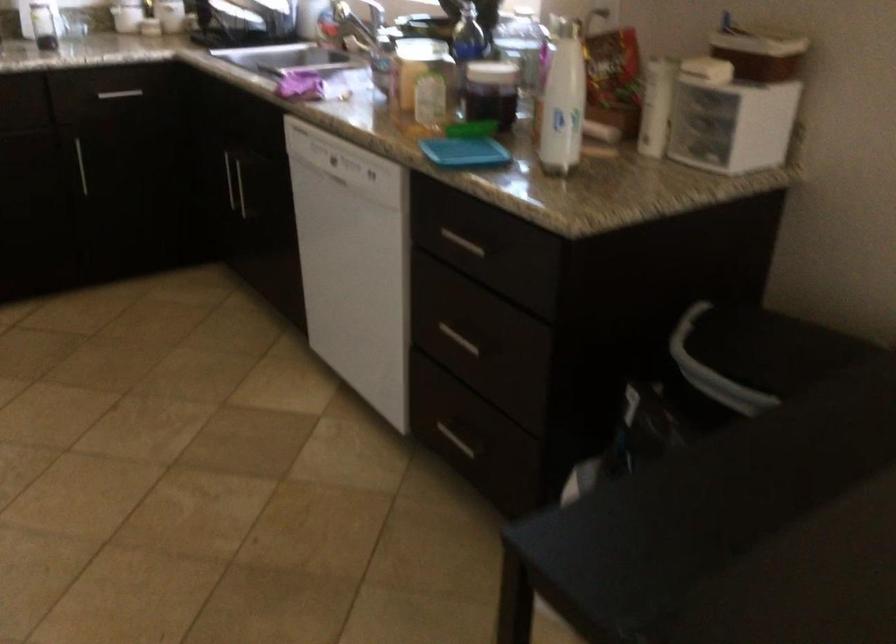
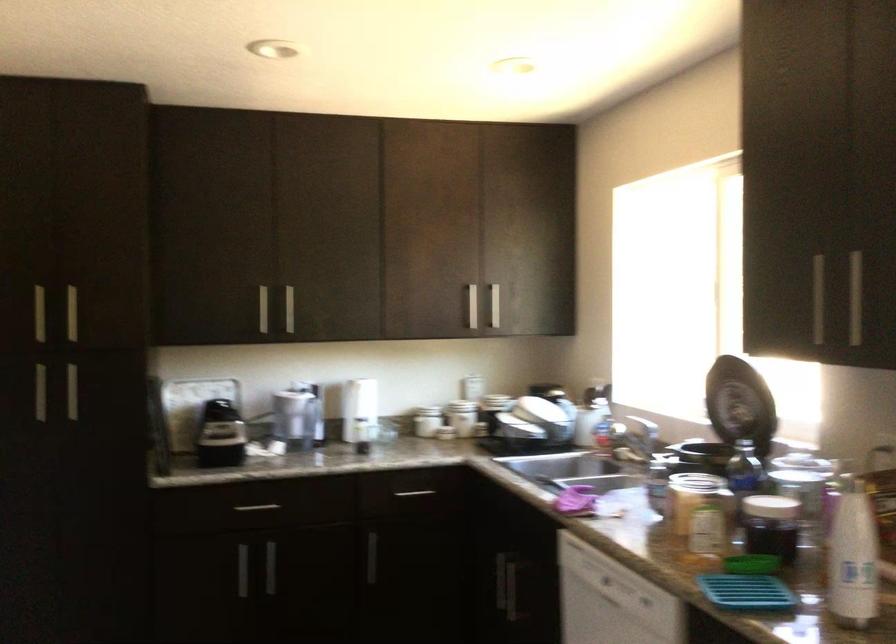
In the second image, find the point that corresponds to point (462, 152) in the first image.

(745, 592)